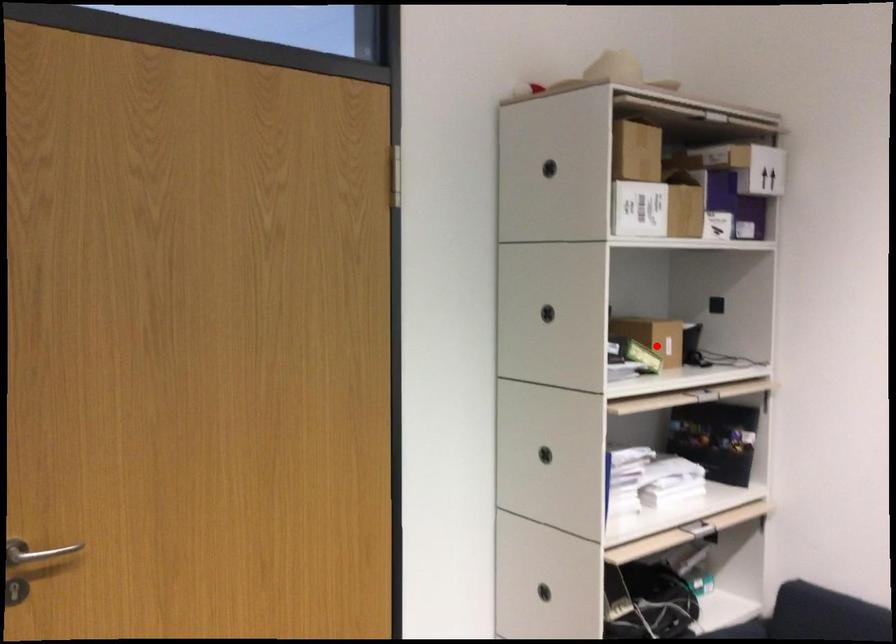
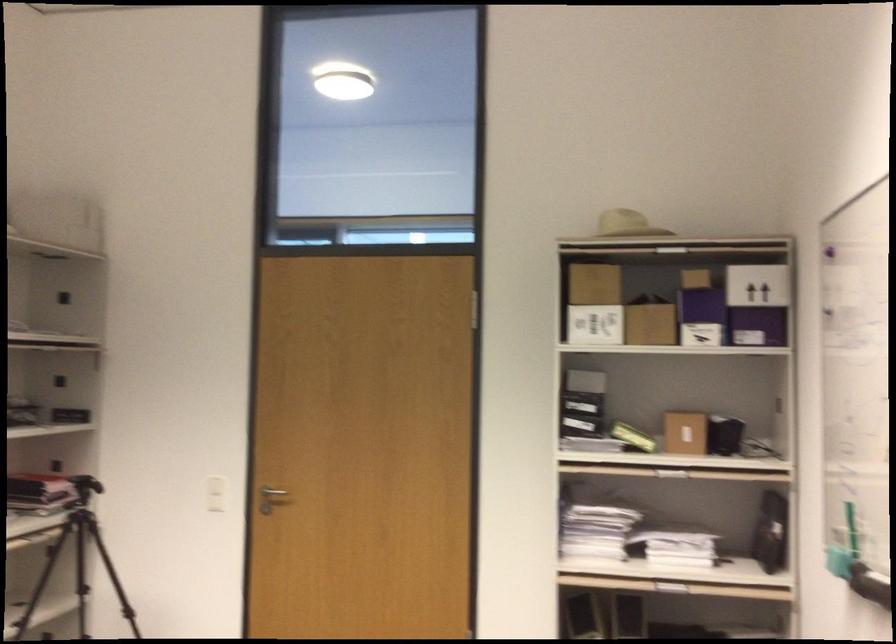
The point at the highlighted location is marked in the first image. Where is the corresponding point in the second image?

(684, 431)